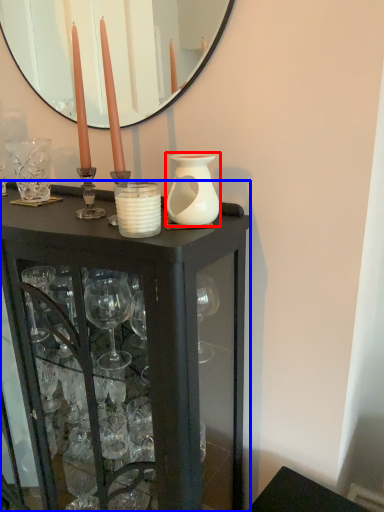
Question: Which object is closer to the camera taking this photo, vase (highlighted by a red box) or table (highlighted by a blue box)?

Choices:
 (A) vase
 (B) table

Answer: (B)